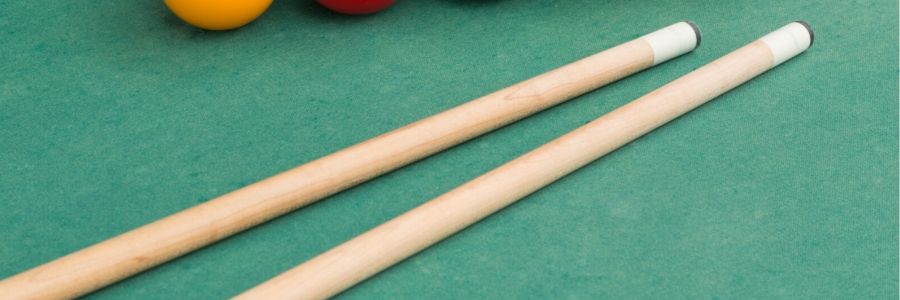
At what (x,y) coordinates should I click in order to perform the action: click on light wooden surface. Please return your answer as a coordinate pair (x, y). Looking at the image, I should click on (313, 176), (418, 241).